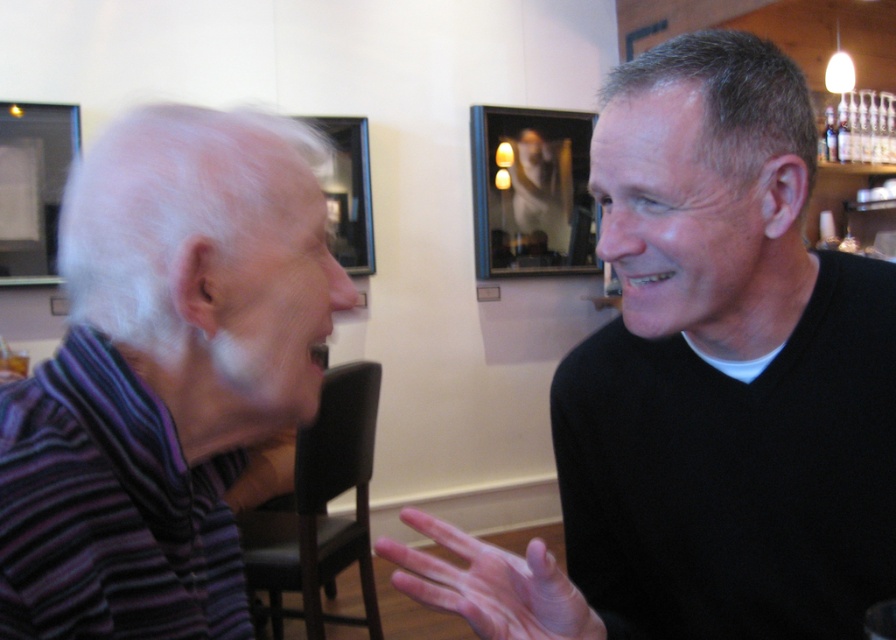
Is black matte sweater at center thinner than purple striped sweater at left?

No.

Locate an element on the screen. The image size is (896, 640). black matte sweater at center is located at coordinates (705, 385).

Image resolution: width=896 pixels, height=640 pixels. Find the location of `black matte sweater at center`. black matte sweater at center is located at coordinates (705, 385).